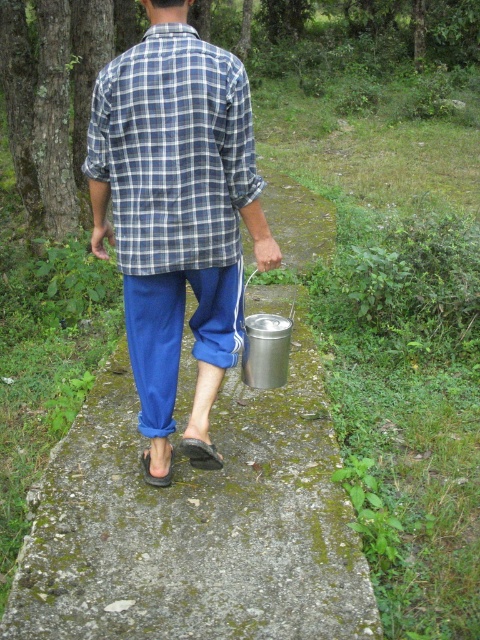
Consider the image. Can you confirm if blue cotton pants at lower center is smaller than blue plaid shirt at center?

Incorrect, blue cotton pants at lower center is not smaller in size than blue plaid shirt at center.

Does blue cotton pants at lower center have a greater height compared to blue plaid shirt at center?

Correct, blue cotton pants at lower center is much taller as blue plaid shirt at center.

Which is in front, point (175, 136) or point (158, 108)?

Positioned in front is point (158, 108).

The height and width of the screenshot is (640, 480). I want to click on blue cotton pants at lower center, so click(177, 214).

Can you confirm if mossy concrete pavement at center is positioned to the right of blue cotton pants at lower center?

Indeed, mossy concrete pavement at center is positioned on the right side of blue cotton pants at lower center.

Who is more distant from viewer, (212, 589) or (159, 58)?

The point (159, 58) is more distant.

The width and height of the screenshot is (480, 640). In order to click on mossy concrete pavement at center in this screenshot , I will do `click(195, 524)`.

Which is more to the left, mossy concrete pavement at center or blue plaid shirt at center?

blue plaid shirt at center is more to the left.

Can you confirm if mossy concrete pavement at center is bigger than blue plaid shirt at center?

Yes, mossy concrete pavement at center is bigger than blue plaid shirt at center.

Who is more forward, (106, 467) or (204, 257)?

Positioned in front is point (204, 257).

Identify the location of mossy concrete pavement at center. (195, 524).